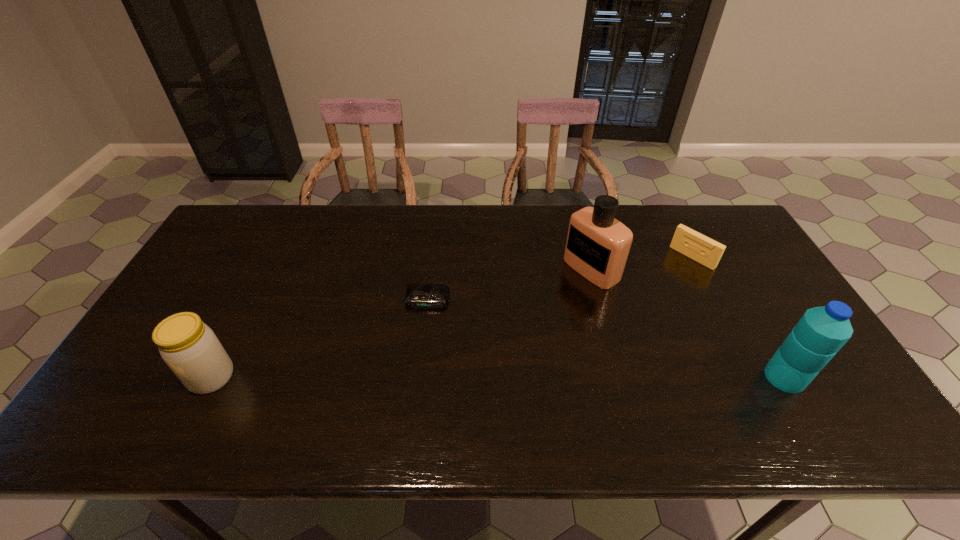
This screenshot has height=540, width=960. What are the coordinates of `object that is the third closest one to the fourth object from right to left` in the screenshot? It's located at (706, 251).

Find the location of a particular element. The width and height of the screenshot is (960, 540). object that stands as the third closest to the videotape is located at coordinates (418, 295).

What are the coordinates of `free space that satisfies the following two spatial constraints: 1. on the front side of the perfume; 2. on the right side of the water bottle` in the screenshot? It's located at (620, 377).

Locate an element on the screen. The image size is (960, 540). free space that satisfies the following two spatial constraints: 1. on the back side of the third tallest object; 2. on the right side of the alarm clock is located at coordinates (251, 300).